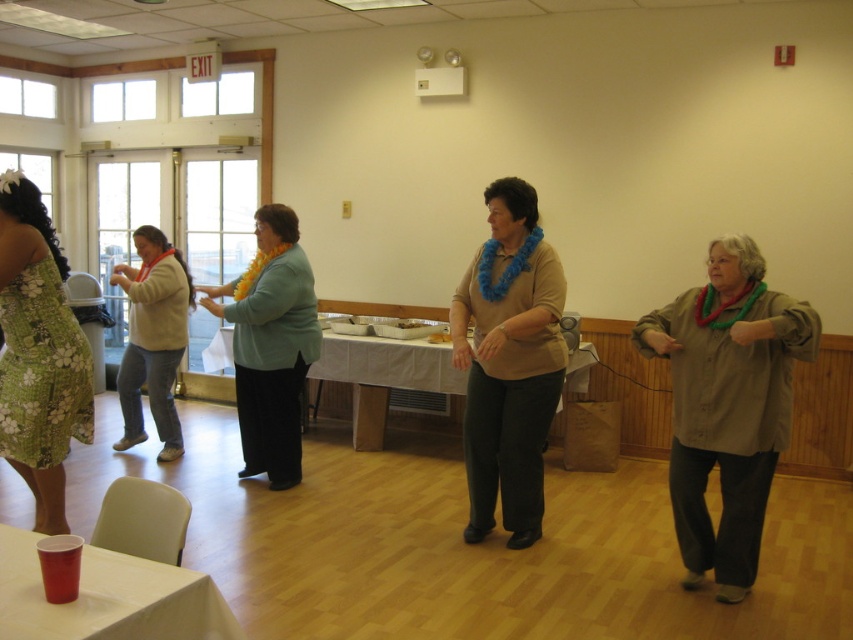
Which of these two, teal fabric jacket at center or white cloth-covered table at center, stands taller?

teal fabric jacket at center is taller.

Can you confirm if teal fabric jacket at center is wider than white cloth-covered table at center?

In fact, teal fabric jacket at center might be narrower than white cloth-covered table at center.

Who is more forward, (239, 278) or (374, 353)?

Point (239, 278) is in front.

Locate an element on the screen. The image size is (853, 640). teal fabric jacket at center is located at coordinates (270, 346).

How distant is teal fabric jacket at center from red plastic cup at lower left?

8.41 feet

Measure the distance between teal fabric jacket at center and red plastic cup at lower left.

teal fabric jacket at center is 8.41 feet away from red plastic cup at lower left.

Does point (253, 444) come farther from viewer compared to point (158, 616)?

Yes.

Identify the location of teal fabric jacket at center. (270, 346).

Is blue fabric lei at center to the left of beige sweater at left from the viewer's perspective?

Incorrect, blue fabric lei at center is not on the left side of beige sweater at left.

Which is in front, point (518, 378) or point (138, 314)?

Point (518, 378) is more forward.

Describe the element at coordinates (508, 362) in the screenshot. I see `blue fabric lei at center` at that location.

Find the location of a particular element. blue fabric lei at center is located at coordinates (508, 362).